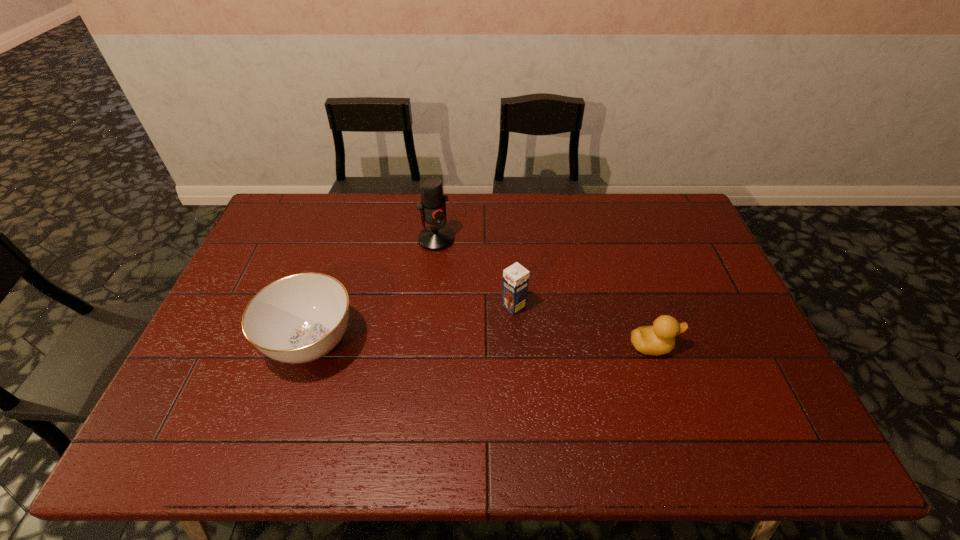
Where is `blank region between the shortest object and the second object from right to left`? The height and width of the screenshot is (540, 960). blank region between the shortest object and the second object from right to left is located at coordinates (583, 326).

You are a GUI agent. You are given a task and a screenshot of the screen. Output one action in this format:
    pyautogui.click(x=<x>, y=<y>)
    Task: Click on the vacant space in between the second object from left to right and the second object from right to left
    The image size is (960, 540).
    Given the screenshot: What is the action you would take?
    pyautogui.click(x=475, y=273)

The width and height of the screenshot is (960, 540). In order to click on vacant point located between the chocolate milk and the third object from right to left in this screenshot , I will do `click(475, 273)`.

Locate which object is the third closest to the second object from right to left. Please provide its 2D coordinates. Your answer should be formatted as a tuple, i.e. [(x, y)], where the tuple contains the x and y coordinates of a point satisfying the conditions above.

[(300, 318)]

You are a GUI agent. You are given a task and a screenshot of the screen. Output one action in this format:
    pyautogui.click(x=<x>, y=<y>)
    Task: Click on the second closest object to the duckling
    The height and width of the screenshot is (540, 960).
    Given the screenshot: What is the action you would take?
    pyautogui.click(x=432, y=207)

This screenshot has height=540, width=960. I want to click on free space that satisfies the following two spatial constraints: 1. on the front side of the rightmost object; 2. on the face of the chocolate milk, so click(x=516, y=346).

The height and width of the screenshot is (540, 960). Identify the location of free location that satisfies the following two spatial constraints: 1. on the front side of the rightmost object; 2. on the face of the leftmost object. (311, 346).

Find the location of `free location that satisfies the following two spatial constraints: 1. on the back side of the farthest object; 2. on the left side of the leftmost object`. free location that satisfies the following two spatial constraints: 1. on the back side of the farthest object; 2. on the left side of the leftmost object is located at coordinates (345, 239).